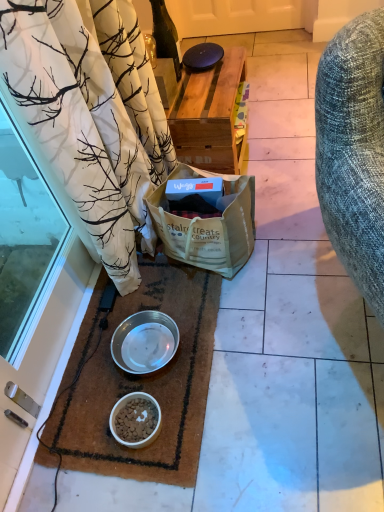
At what (x,y) coordinates should I click in order to perform the action: click on vacant area that lies in front of green glass bottle at upper center. Please return your answer as a coordinate pair (x, y). The width and height of the screenshot is (384, 512). Looking at the image, I should click on (197, 87).